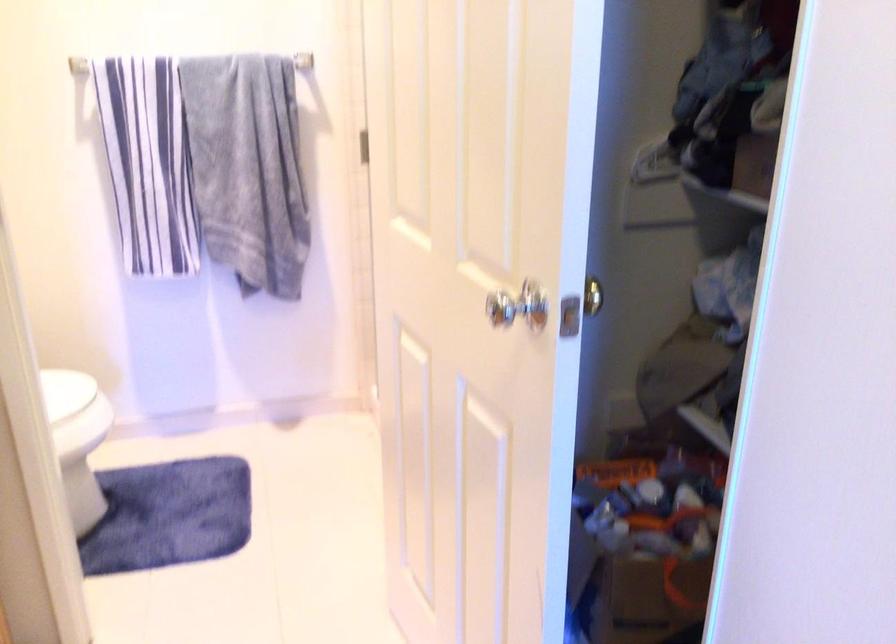
At what (x,y) coordinates should I click in order to perform the action: click on metal towel rack. Please return your answer as a coordinate pair (x, y). This screenshot has width=896, height=644. Looking at the image, I should click on (281, 62).